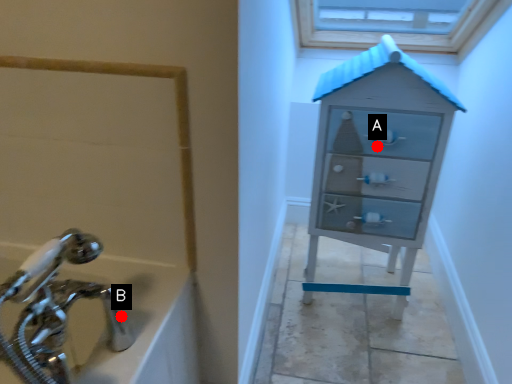
Question: Two points are circled on the image, labeled by A and B beside each circle. Which of the following is the closest to the observer?

Choices:
 (A) A is closer
 (B) B is closer

Answer: (B)